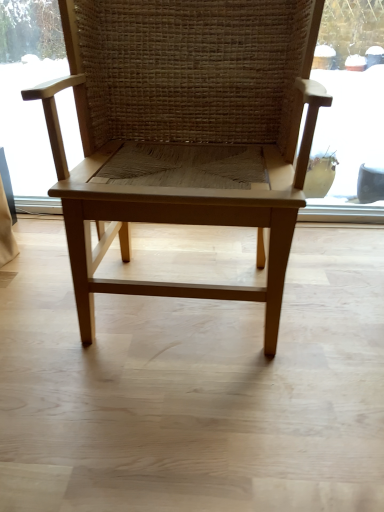
Measure the distance between light wood chair at center and camera.

A distance of 32.36 inches exists between light wood chair at center and camera.

At what (x,y) coordinates should I click in order to perform the action: click on light wood chair at center. Please return your answer as a coordinate pair (x, y). Image resolution: width=384 pixels, height=512 pixels. Looking at the image, I should click on (184, 132).

This screenshot has width=384, height=512. Describe the element at coordinates (184, 132) in the screenshot. I see `light wood chair at center` at that location.

Locate an element on the screen. light wood chair at center is located at coordinates (184, 132).